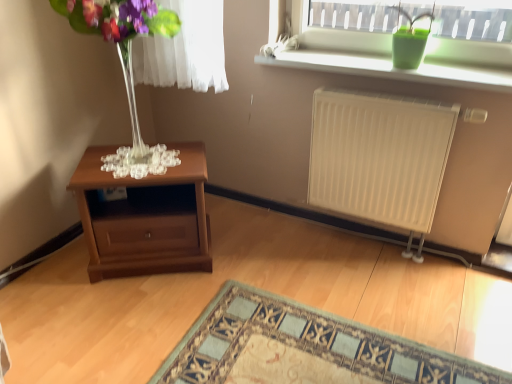
Identify the location of free space to the left of white matte radiator at right. The image size is (512, 384). (281, 253).